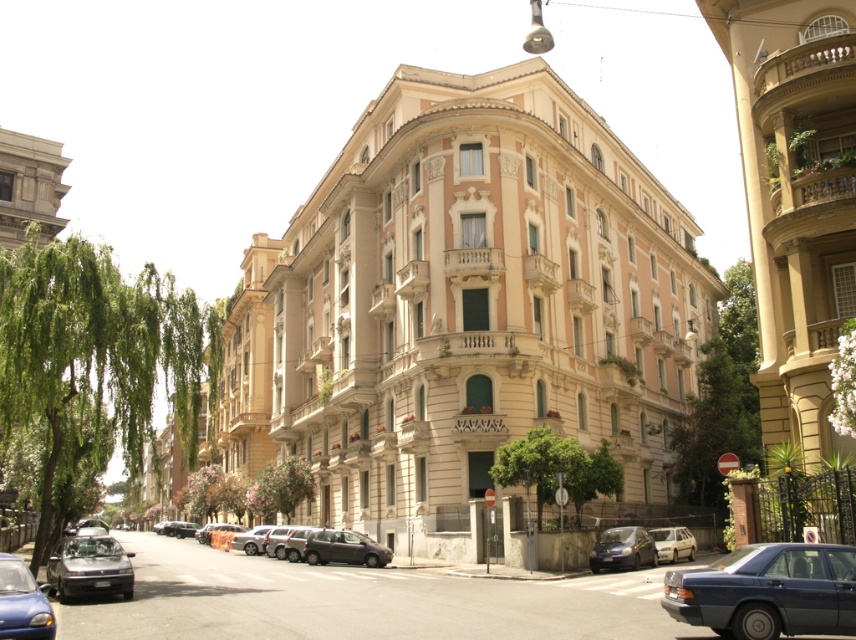
Does matte black car at center appear on the right side of silver metallic sedan at center?

Incorrect, matte black car at center is not on the right side of silver metallic sedan at center.

The width and height of the screenshot is (856, 640). What are the coordinates of `matte black car at center` in the screenshot? It's located at (324, 547).

Which is above, metallic blue sedan at lower right or shiny black car at lower left?

metallic blue sedan at lower right is above.

Between point (785, 620) and point (85, 532), which one is positioned behind?

Positioned behind is point (85, 532).

Measure the distance between point (736, 561) and camera.

43.37 meters

Locate an element on the screen. The width and height of the screenshot is (856, 640). metallic blue sedan at lower right is located at coordinates (768, 592).

Is point (831, 608) farther from viewer compared to point (376, 548)?

No.

Is metallic blue sedan at lower right to the right of dark gray metallic car at center from the viewer's perspective?

Yes, metallic blue sedan at lower right is to the right of dark gray metallic car at center.

Does point (764, 620) come farther from viewer compared to point (343, 541)?

No, it is in front of (343, 541).

At what (x,y) coordinates should I click in order to perform the action: click on metallic blue sedan at lower right. Please return your answer as a coordinate pair (x, y). Image resolution: width=856 pixels, height=640 pixels. Looking at the image, I should click on (768, 592).